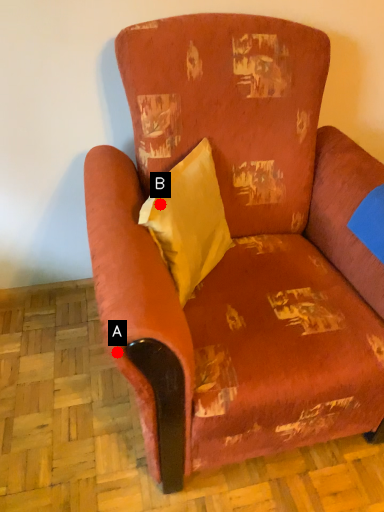
Question: Two points are circled on the image, labeled by A and B beside each circle. Which point is closer to the camera?

Choices:
 (A) A is closer
 (B) B is closer

Answer: (A)